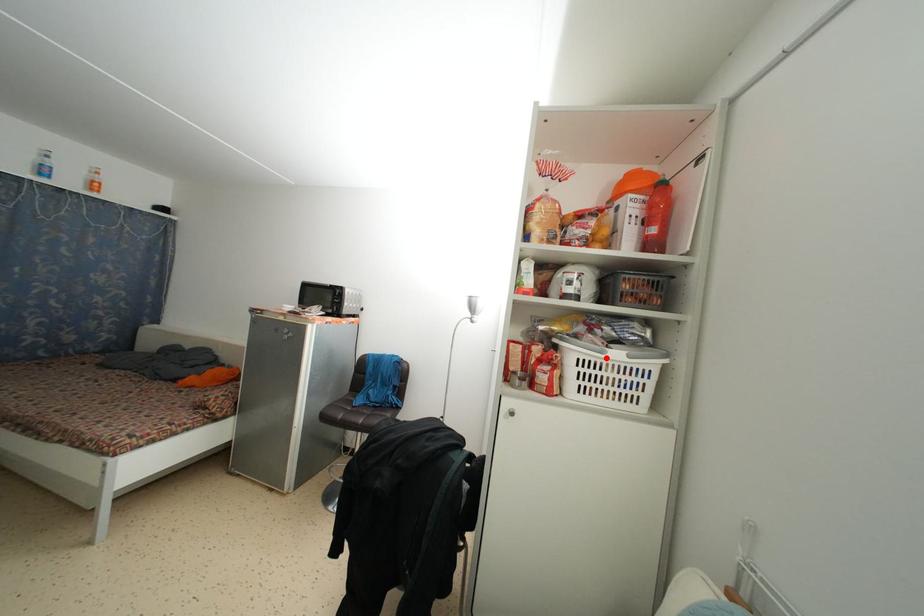
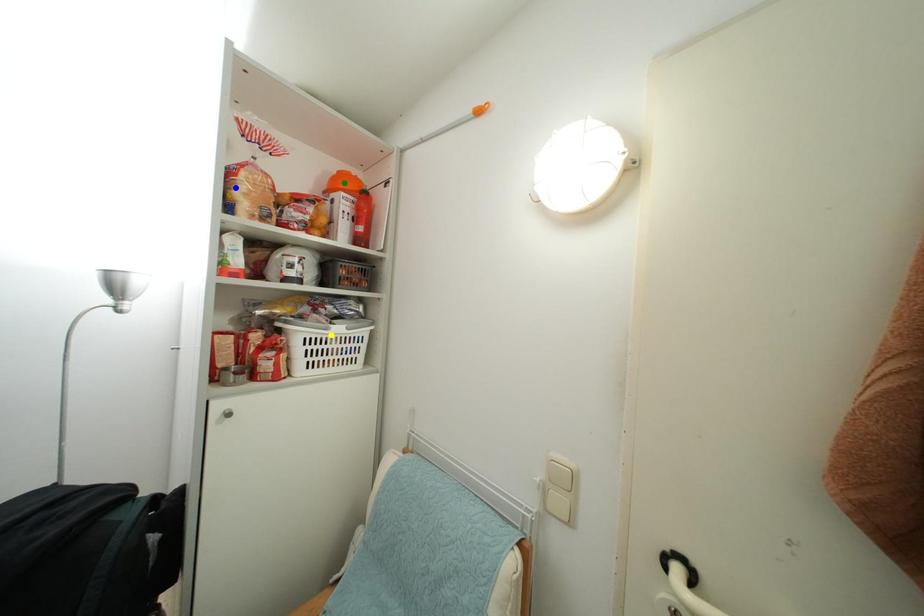
Question: I am providing you with two images of the same scene from different viewpoints. A red point is marked on the first image. You are given multiple points on the second image. Which mark in image 2 goes with the point in image 1?

Choices:
 (A) yellow point
 (B) blue point
 (C) green point

Answer: (A)